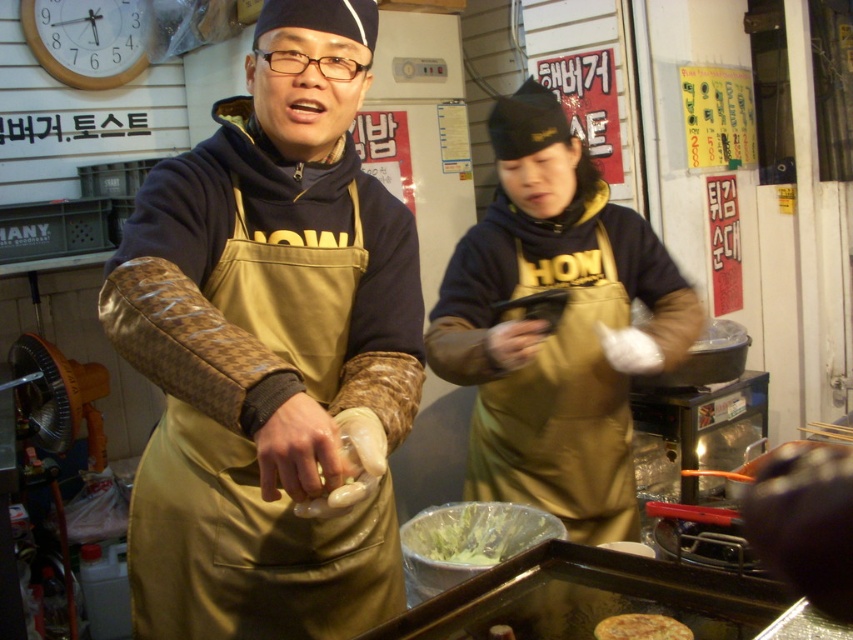
You are a customer at this food stall and want to grab the green leafy vegetables in plastic bag at center. However, the gold leather apron at center is in your way. Can you reach the vegetables without moving the apron?

The green leafy vegetables in plastic bag at center is behind the gold leather apron at center, so you can reach around or behind the apron to grab them without moving it.

Based on the scene description, where is the gold leather apron at center located in terms of its 2D coordinates?

The gold leather apron at center is located at the 2D coordinates point [556,326].